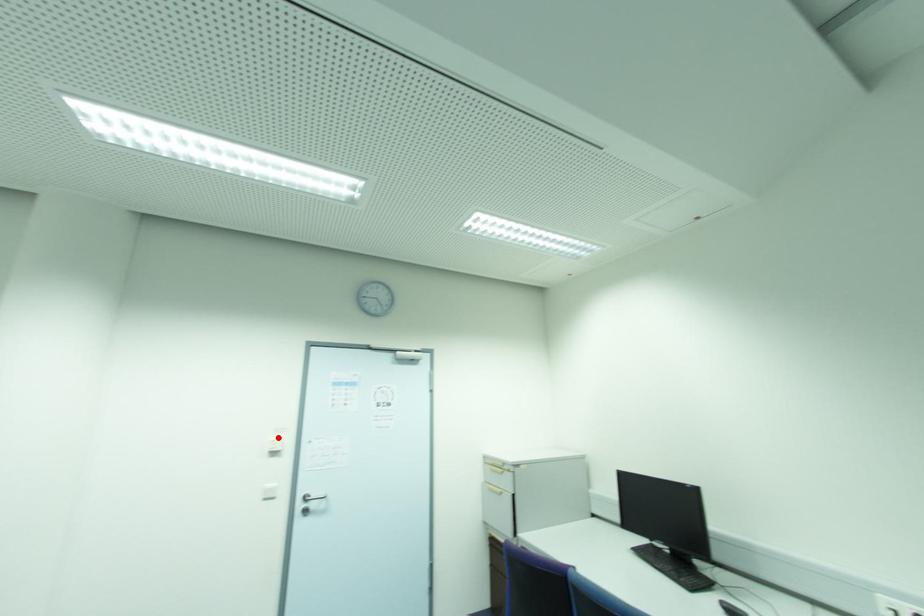
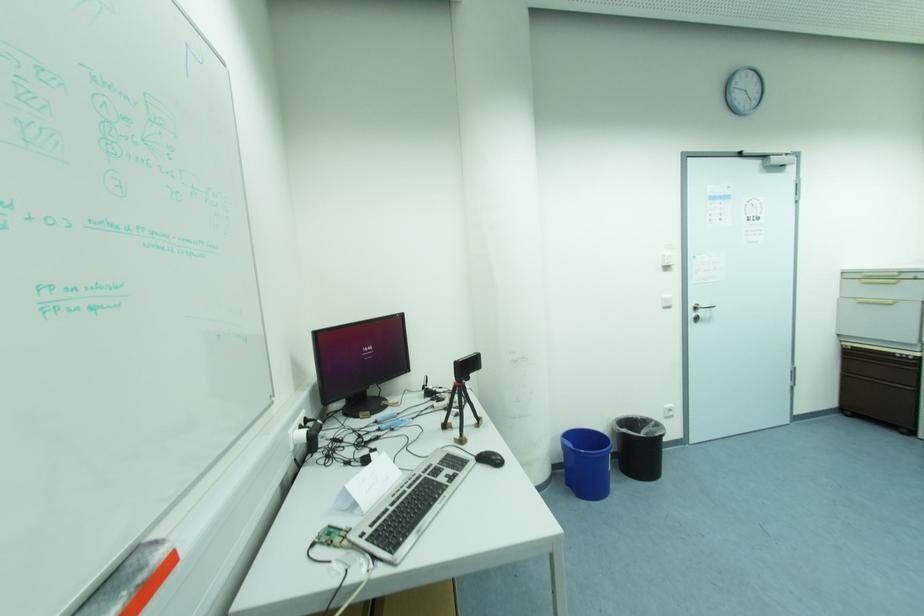
In the second image, find the point that corresponds to the highlighted location in the first image.

(669, 254)